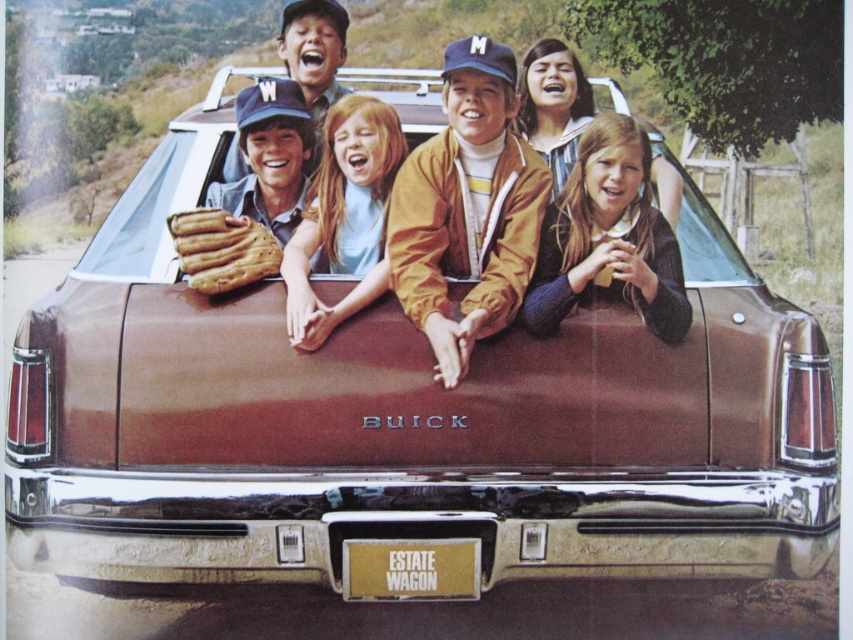
Question: From the image, what is the correct spatial relationship of brown matte jacket at center in relation to brown leather baseball glove at center?

Choices:
 (A) above
 (B) below

Answer: (A)

Question: Considering the real-world distances, which object is farthest from the matte brown baseball glove at center?

Choices:
 (A) brown leather baseball glove at center
 (B) brown matte jacket at center
 (C) knitted sweater at center
 (D) smooth brown hair at center

Answer: (C)

Question: Can you confirm if brown matte jacket at center is positioned to the right of knitted sweater at center?

Choices:
 (A) no
 (B) yes

Answer: (A)

Question: Is knitted sweater at center to the left of brown leather baseball glove at center from the viewer's perspective?

Choices:
 (A) no
 (B) yes

Answer: (A)

Question: Estimate the real-world distances between objects in this image. Which object is closer to the matte brown baseball glove at center?

Choices:
 (A) brown leather baseball glove at center
 (B) smooth brown hair at center
 (C) knitted sweater at center

Answer: (B)

Question: Which point is closer to the camera?

Choices:
 (A) (573, 204)
 (B) (202, 282)

Answer: (B)